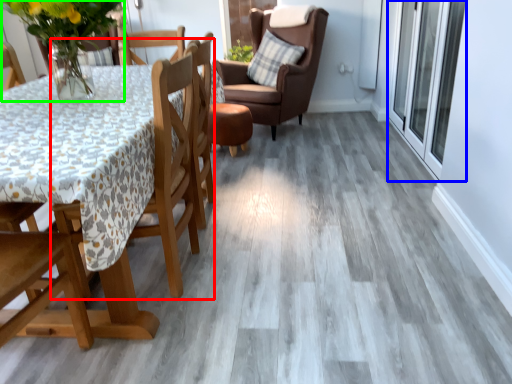
Question: Which object is the farthest from chair (highlighted by a red box)? Choose among these: screen door (highlighted by a blue box) or floral arrangement (highlighted by a green box).

Choices:
 (A) screen door
 (B) floral arrangement

Answer: (A)